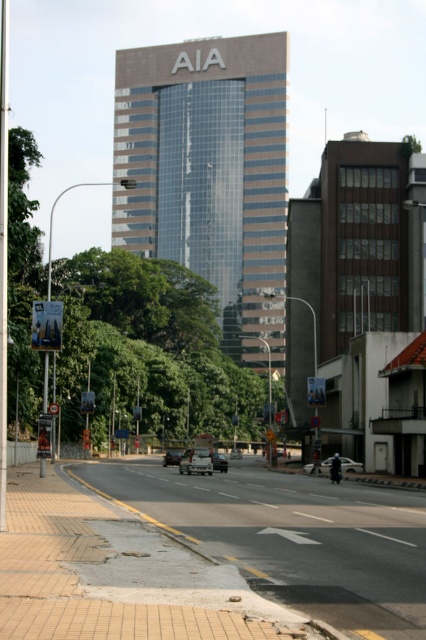
Question: In this image, where is concrete sidewalk at lower left located relative to metallic silver car at center?

Choices:
 (A) right
 (B) left

Answer: (A)

Question: Which is farther from the matte silver van at center?

Choices:
 (A) metallic silver car at center
 (B) matte black van at center
 (C) matte black car at center

Answer: (C)

Question: Considering the real-world distances, which object is farthest from the dark gray metallic car at center?

Choices:
 (A) white plastic circle at center
 (B) matte black car at center
 (C) concrete sidewalk at lower left

Answer: (C)

Question: Does matte silver van at center appear under white plastic circle at center?

Choices:
 (A) yes
 (B) no

Answer: (A)

Question: Can you confirm if matte black car at center is smaller than matte silver van at center?

Choices:
 (A) yes
 (B) no

Answer: (B)

Question: Which point appears closest to the camera in this image?

Choices:
 (A) (169, 456)
 (B) (54, 403)

Answer: (B)